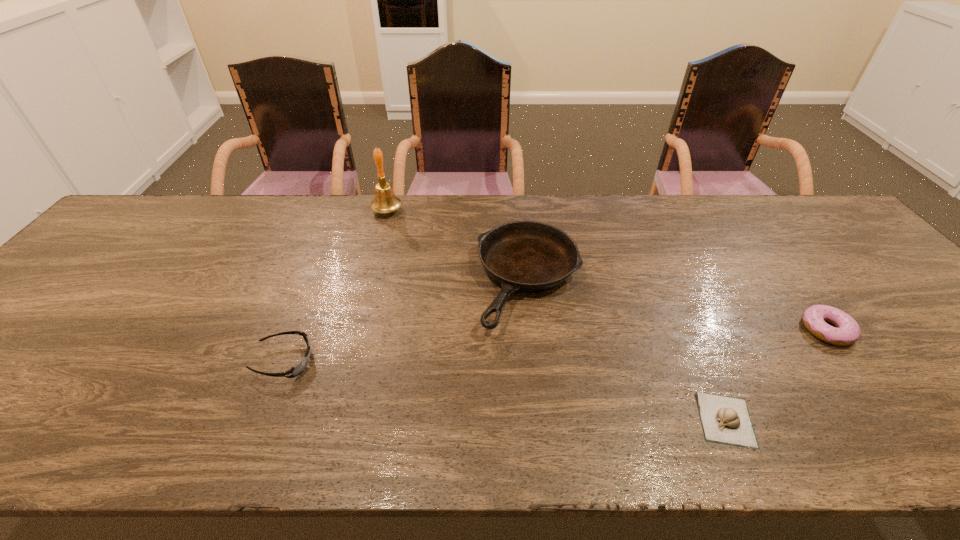
This screenshot has height=540, width=960. I want to click on the farthest object, so [385, 201].

Find the location of a particular element. the second object from left to right is located at coordinates (385, 201).

Locate an element on the screen. The image size is (960, 540). the fourth shortest object is located at coordinates (522, 256).

At what (x,y) coordinates should I click in order to perform the action: click on the third object from right to left. Please return your answer as a coordinate pair (x, y). The height and width of the screenshot is (540, 960). Looking at the image, I should click on (522, 256).

Where is `the leftmost object`? Image resolution: width=960 pixels, height=540 pixels. the leftmost object is located at coordinates (298, 369).

Where is `the rightmost object`? The image size is (960, 540). the rightmost object is located at coordinates (815, 317).

Find the location of a particular element. the shortest object is located at coordinates (726, 420).

Where is `the fourth object from left to right`? The width and height of the screenshot is (960, 540). the fourth object from left to right is located at coordinates click(726, 420).

Find the location of a particular element. vacant space located 0.400m on the right of the farthest object is located at coordinates (527, 211).

This screenshot has height=540, width=960. Identify the location of vacant space situated 0.160m on the front of the second tallest object. (543, 400).